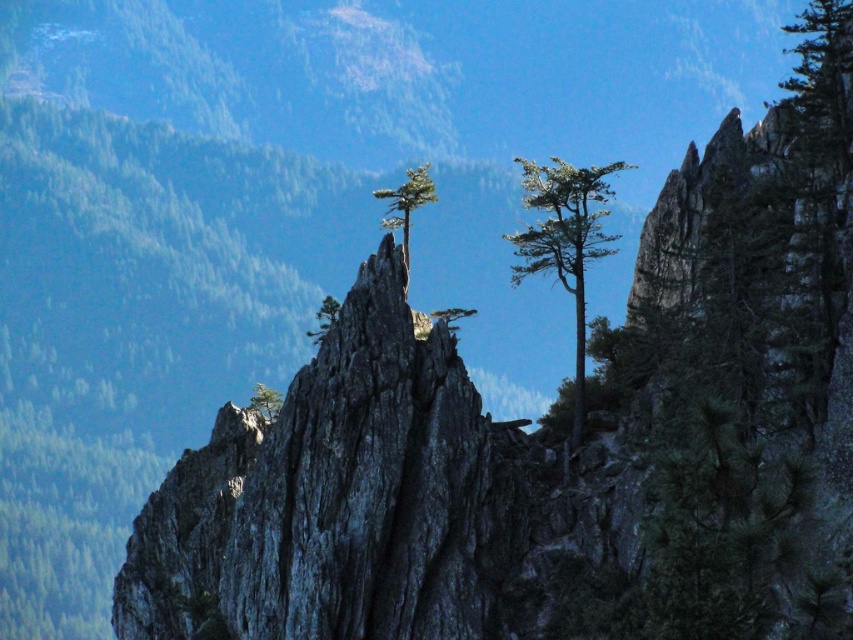
Question: Which object appears farthest from the camera in this image?

Choices:
 (A) green needle-like tree at center-right
 (B) green textured tree at center

Answer: (A)

Question: Among these objects, which one is nearest to the camera?

Choices:
 (A) green textured tree at center
 (B) green needle-like tree at center-right

Answer: (A)

Question: Which object appears farthest from the camera in this image?

Choices:
 (A) green textured tree at center
 (B) green needle-like tree at center-right

Answer: (B)

Question: Can you confirm if green needle-like tree at center-right is smaller than green textured tree at center?

Choices:
 (A) yes
 (B) no

Answer: (B)

Question: Can you confirm if green needle-like tree at center-right is wider than green textured tree at center?

Choices:
 (A) no
 (B) yes

Answer: (B)

Question: Where is green needle-like tree at center-right located in relation to green textured tree at center in the image?

Choices:
 (A) left
 (B) right

Answer: (B)